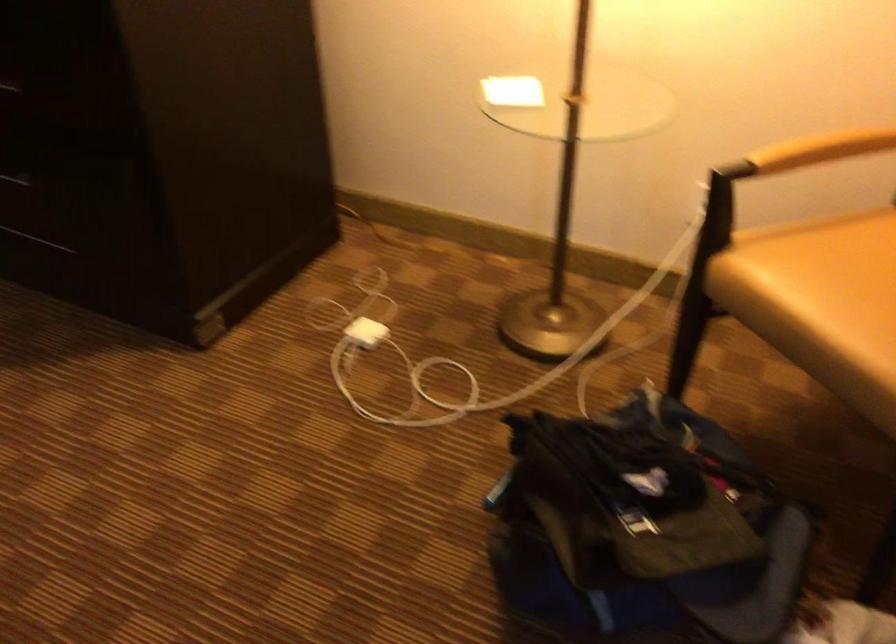
Find where to grip the wooden chair armrest. Please return your answer as a coordinate pair (x, y).

(821, 149)